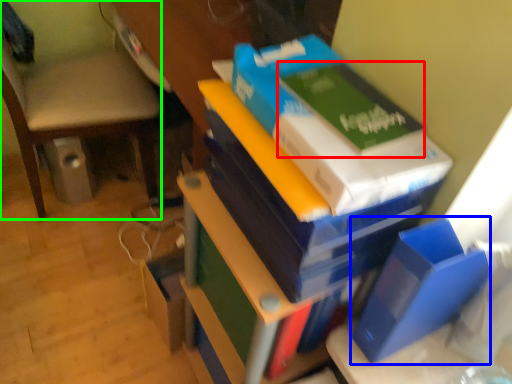
Question: Which is farther away from paperback book (highlighted by a red box)? paperback book (highlighted by a blue box) or chair (highlighted by a green box)?

Choices:
 (A) paperback book
 (B) chair

Answer: (B)